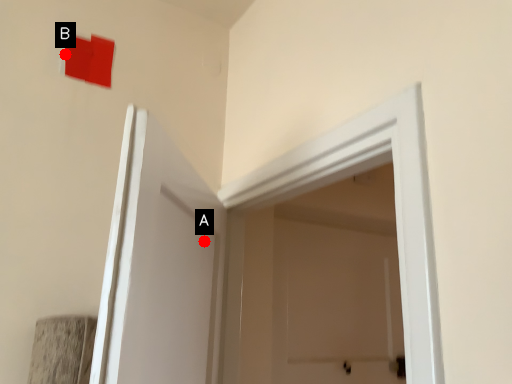
Question: Two points are circled on the image, labeled by A and B beside each circle. Which point appears closest to the camera in this image?

Choices:
 (A) A is closer
 (B) B is closer

Answer: (A)